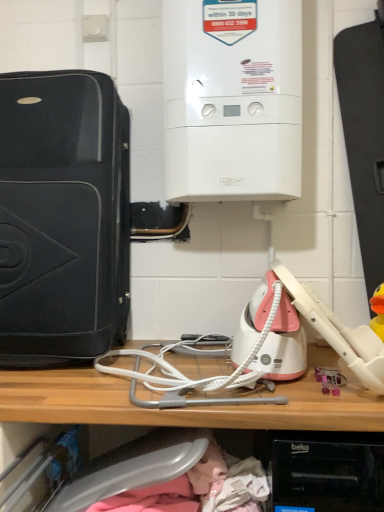
Question: From a real-world perspective, is matte black suitcase at left, placed as the 2th home appliance when sorted from right to left, above or below white textured wire at center, positioned as the 1th wire in bottom-to-top order?

Choices:
 (A) above
 (B) below

Answer: (A)

Question: From their relative heights in the image, would you say matte black suitcase at left, positioned as the 1th home appliance in left-to-right order, is taller or shorter than white textured wire at center, the second wire positioned from the top?

Choices:
 (A) tall
 (B) short

Answer: (A)

Question: Estimate the real-world distances between objects in this image. Which object is closer to the white glossy boiler at upper center, the 2th home appliance from the left?

Choices:
 (A) pink plastic toy at lower right
 (B) white textured wire at center, positioned as the 1th wire in bottom-to-top order
 (C) matte black suitcase at left, placed as the 2th home appliance when sorted from right to left
 (D) wooden shelf at center
 (E) white textured wire at center, the first wire positioned from the top

Answer: (C)

Question: Which is nearer to the white glossy boiler at upper center, the 2th home appliance from the left?

Choices:
 (A) white textured wire at center, which is counted as the 2th wire, starting from the bottom
 (B) wooden shelf at center
 (C) white textured wire at center, positioned as the 1th wire in bottom-to-top order
 (D) matte black suitcase at left, placed as the 2th home appliance when sorted from right to left
 (E) pink plastic toy at lower right

Answer: (D)